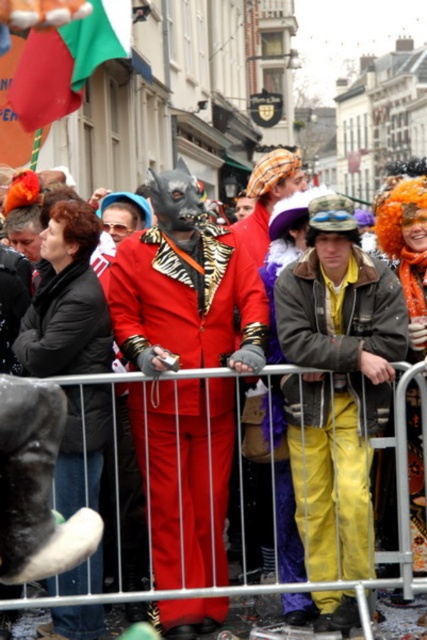
Question: Does shiny red suit at center lie in front of velvet black boot at lower left?

Choices:
 (A) yes
 (B) no

Answer: (B)

Question: Which object is positioned farthest from the velvet black boot at lower left?

Choices:
 (A) yellow matte pants at center
 (B) metallic silver barrier at center

Answer: (A)

Question: Does shiny red suit at center appear on the right side of yellow matte pants at center?

Choices:
 (A) no
 (B) yes

Answer: (A)

Question: Is yellow matte pants at center wider than metallic silver barrier at center?

Choices:
 (A) yes
 (B) no

Answer: (B)

Question: Which point appears closest to the camera in this image?

Choices:
 (A) (233, 288)
 (B) (63, 621)

Answer: (B)

Question: Which object is the closest to the velvet black boot at lower left?

Choices:
 (A) metallic silver barrier at center
 (B) yellow matte pants at center

Answer: (A)